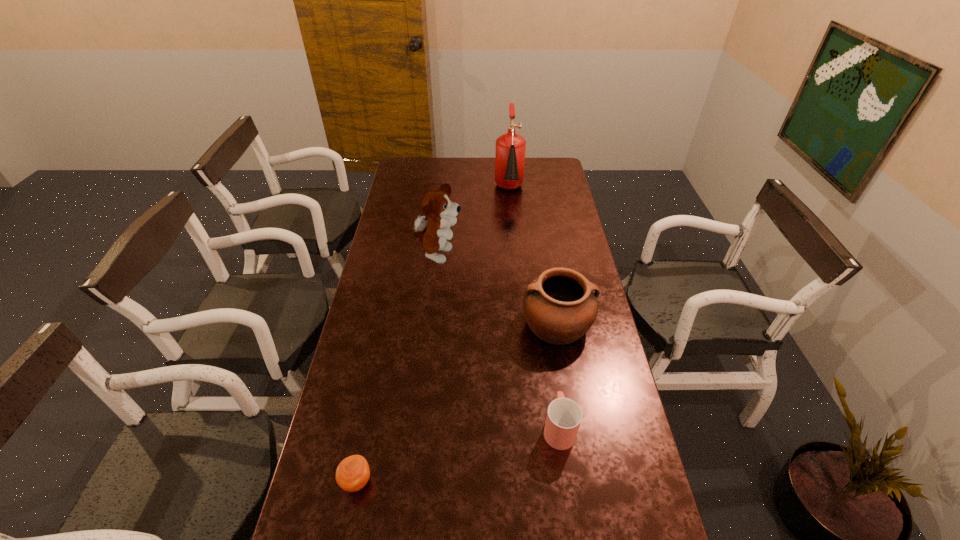
At what (x,y) coordinates should I click in order to perform the action: click on fire extinguisher. Please return your answer as a coordinate pair (x, y). Image resolution: width=960 pixels, height=540 pixels. Looking at the image, I should click on (510, 148).

Locate an element on the screen. Image resolution: width=960 pixels, height=540 pixels. the tallest object is located at coordinates (510, 148).

Locate an element on the screen. This screenshot has width=960, height=540. the fourth object from right to left is located at coordinates (433, 229).

I want to click on puppy, so click(x=433, y=229).

The image size is (960, 540). Identify the location of pottery. tap(560, 306).

Find the location of a particular element. The image size is (960, 540). the third nearest object is located at coordinates (560, 306).

At what (x,y) coordinates should I click in order to perform the action: click on the second nearest object. Please return your answer as a coordinate pair (x, y). Looking at the image, I should click on (564, 416).

Identify the location of cup. The width and height of the screenshot is (960, 540). (564, 416).

Locate an element on the screen. orange is located at coordinates (352, 474).

Find the location of `the shortest object`. the shortest object is located at coordinates (352, 474).